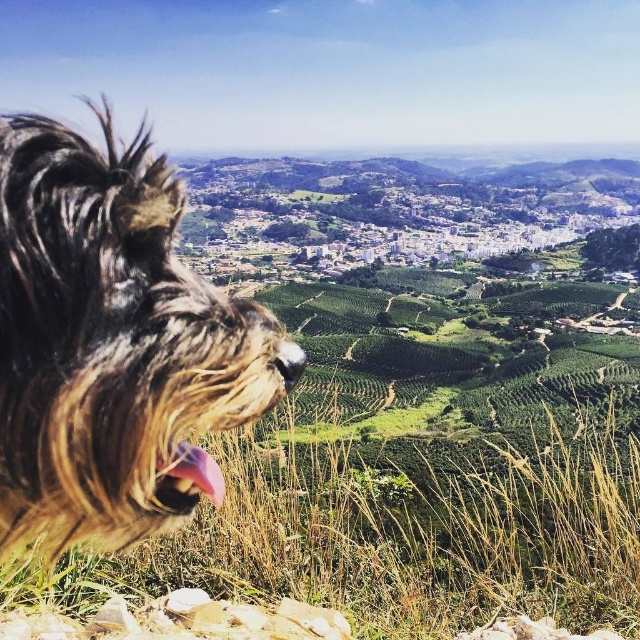
You are a photographer aiming to capture a photo of the fuzzy brown dog at left and the pink fur at lower left. Which object should you focus on first to ensure both are in sharp focus?

You should focus on the fuzzy brown dog at left first because it is closer to the viewer than the pink fur at lower left. By focusing on the closer object, the depth of field may include the farther object in acceptable focus.

You are a photographer trying to capture both the fuzzy brown dog at left and the pink fur at lower left in the same frame. Given their sizes, which one should you focus on to ensure both fit clearly in the photo?

The fuzzy brown dog at left is larger than the pink fur at lower left, so you should focus on the fuzzy brown dog at left to ensure both fit clearly in the photo.

You are a photographer standing at the top of a hill. You want to take a photo of the fuzzy brown dog at left and the pink fur at lower left. The minimum distance between the two subjects should be 10 meters to ensure they are both in focus. Based on the scene, can you achieve this?

The fuzzy brown dog at left and the pink fur at lower left are 8.78 meters apart, which is less than the required 10 meters. Therefore, you cannot achieve the desired focus distance between them.